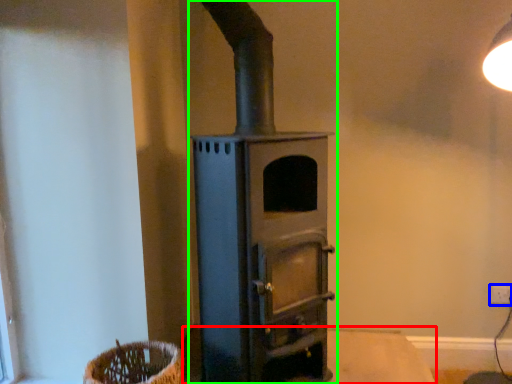
Question: Based on their relative distances, which object is farther from table (highlighted by a red box)? Choose from electric outlet (highlighted by a blue box) and wood burning stove (highlighted by a green box).

Choices:
 (A) electric outlet
 (B) wood burning stove

Answer: (B)